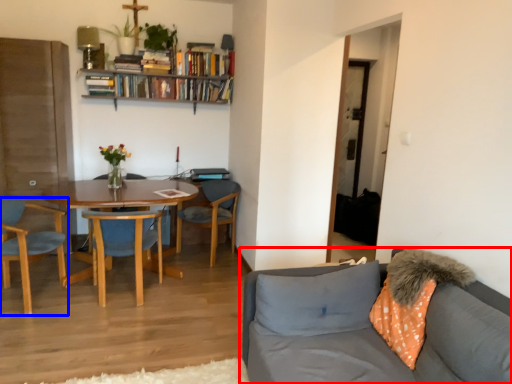
Question: Which of the following is the closest to the observer, studio couch (highlighted by a red box) or chair (highlighted by a blue box)?

Choices:
 (A) studio couch
 (B) chair

Answer: (A)